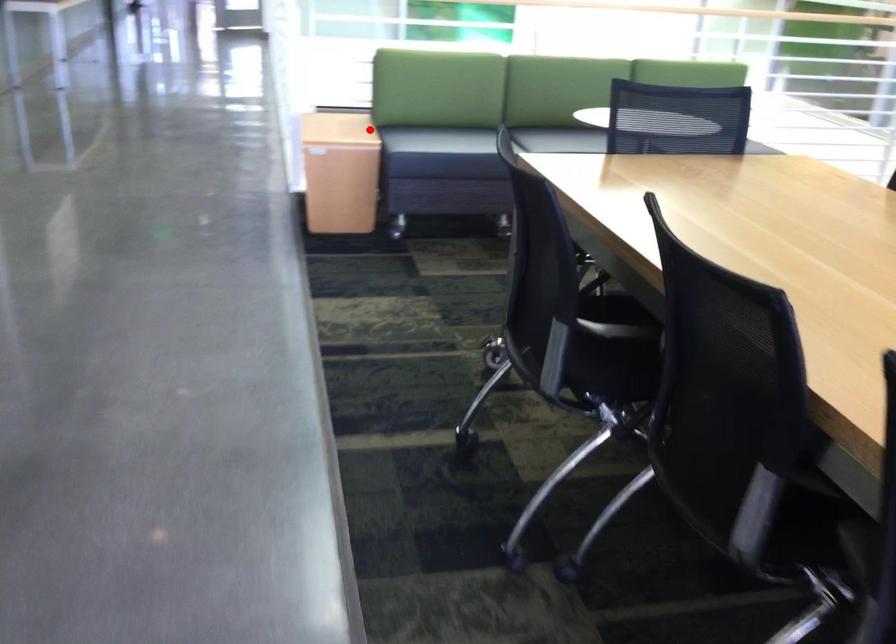
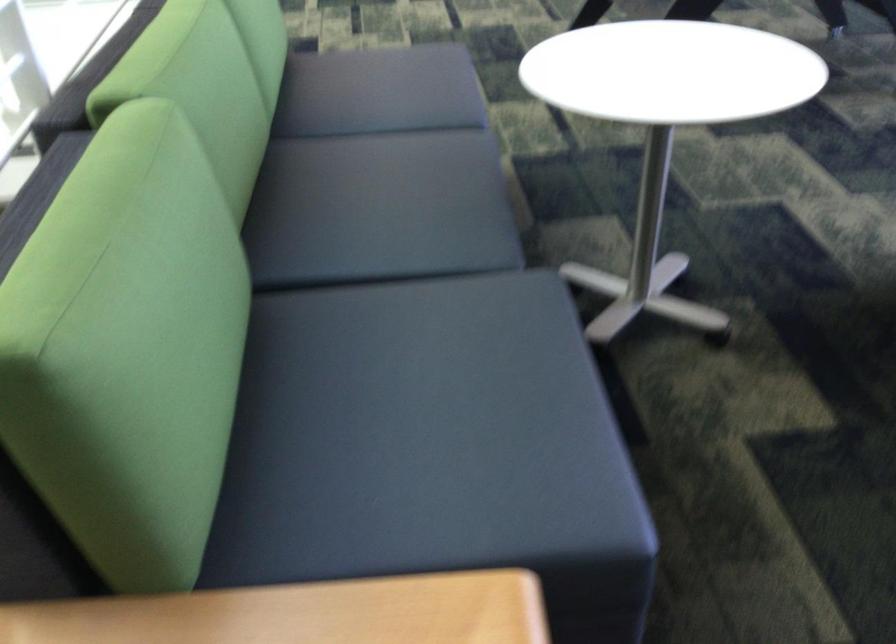
Where in the second image is the point corresponding to the highlighted location from the first image?

(423, 438)